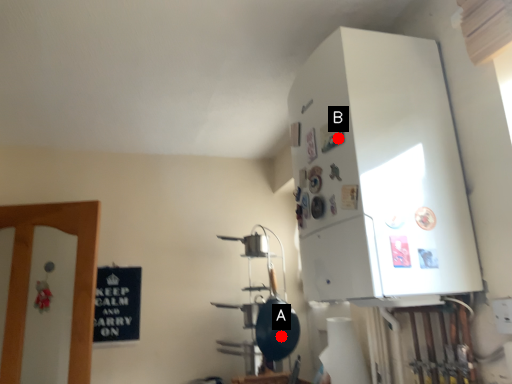
Question: Two points are circled on the image, labeled by A and B beside each circle. Among these points, which one is farthest from the camera?

Choices:
 (A) A is further
 (B) B is further

Answer: (A)